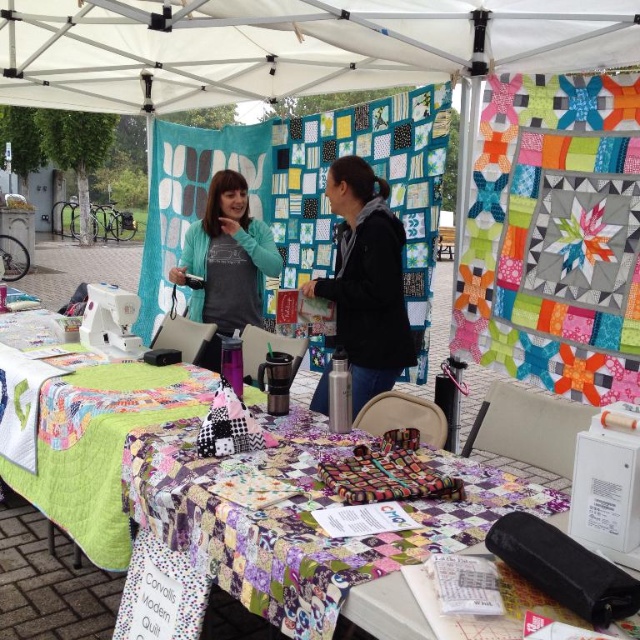
You are setting up a display at the market stall and want to arrange the patchwork fabric at center and the matte teal sweater at center so that the larger item is placed on the table. Which item should you place on the table?

The matte teal sweater at center is larger than the patchwork fabric at center, so you should place the matte teal sweater at center on the table.